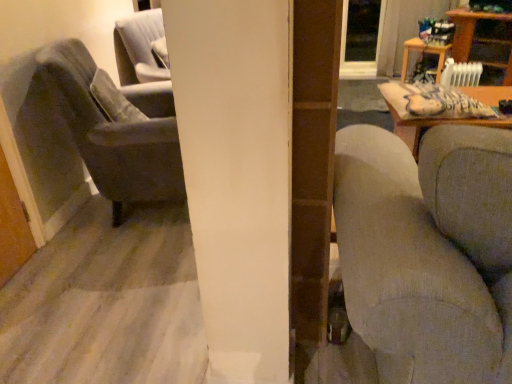
Question: Considering the positions of wooden table at upper right, the second table viewed from the left, and wooden table at upper right, acting as the 1th table starting from the left, in the image, is wooden table at upper right, the second table viewed from the left, wider or thinner than wooden table at upper right, acting as the 1th table starting from the left,?

Choices:
 (A) wide
 (B) thin

Answer: (A)

Question: From their relative heights in the image, would you say wooden table at upper right, the second table viewed from the left, is taller or shorter than wooden table at upper right, the second table when ordered from right to left?

Choices:
 (A) short
 (B) tall

Answer: (B)

Question: Based on their relative distances, which object is farther from the wooden table at upper right, the second table when ordered from right to left?

Choices:
 (A) transparent glass door at upper center
 (B) textured gray couch at right
 (C) wooden table at upper right, the second table viewed from the left
 (D) velvet gray armchair at left

Answer: (B)

Question: Estimate the real-world distances between objects in this image. Which object is farther from the textured gray couch at right?

Choices:
 (A) wooden table at upper right, the second table viewed from the left
 (B) transparent glass door at upper center
 (C) velvet gray armchair at left
 (D) wooden table at upper right, acting as the 1th table starting from the left

Answer: (B)